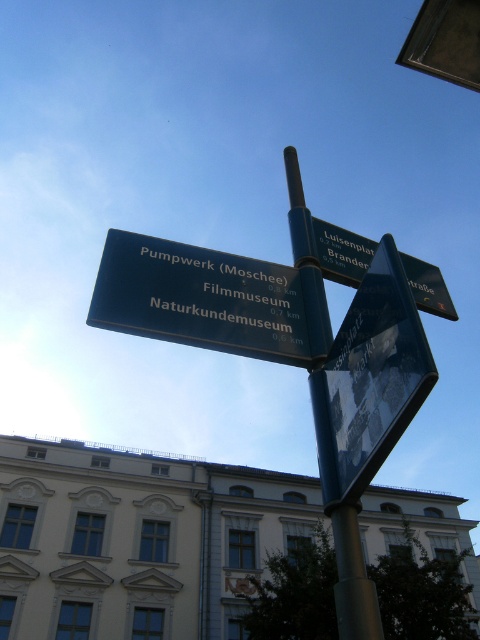
Based on the scene description and the objects provided, what is the significance of the point marked at coordinates (328, 428)?

The point marked at coordinates (328, 428) indicates the location of the green metallic pole at the center of the image, which serves as the base for the directional signpost displaying information about nearby locations such as Pumpwerk, Filmmuseum, and Naturkundemuseum with their respective distances in kilometers.

You are standing in front of the street signpost and notice two signs. The metallic reflective sign at center and the green metallic street sign at upper center. Which one is positioned to the left?

The metallic reflective sign at center is positioned to the left of the green metallic street sign at upper center.

You are standing in front of a green metallic pole at center and a green metallic street sign at upper center. Which object is taller?

The green metallic pole at center is taller than the green metallic street sign at upper center.